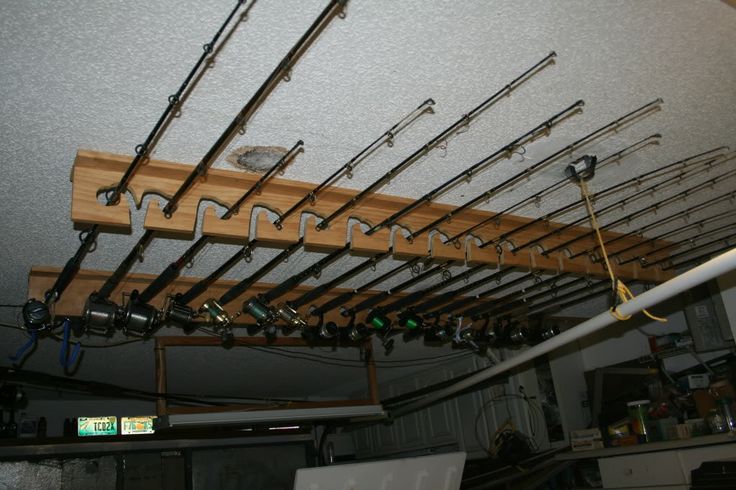
Image resolution: width=736 pixels, height=490 pixels. I want to click on possible chair, so click(403, 478).